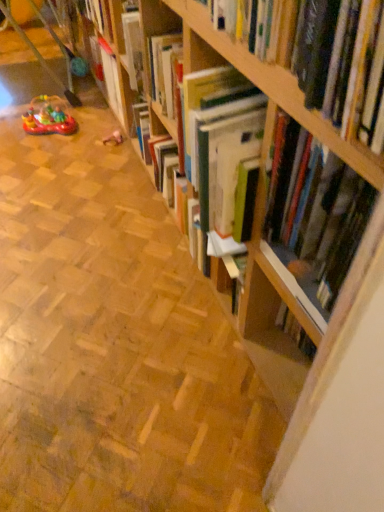
Locate an element on the screen. Image resolution: width=384 pixels, height=512 pixels. vacant space to the right of rubber boat at left, acting as the first toy starting from the left is located at coordinates (96, 129).